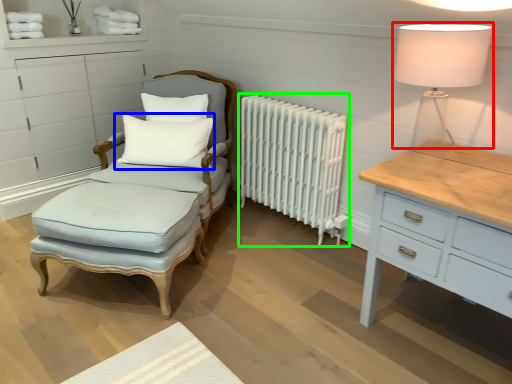
Question: Considering the real-world distances, which object is closest to table lamp (highlighted by a red box)? pillow (highlighted by a blue box) or radiator (highlighted by a green box).

Choices:
 (A) pillow
 (B) radiator

Answer: (B)